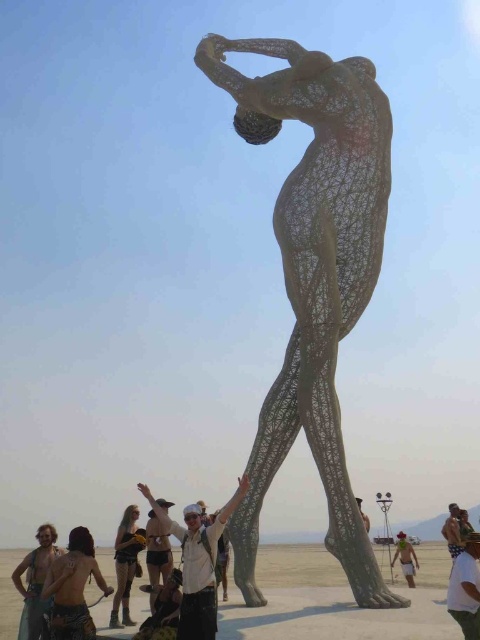
Question: Is white wire mesh figure at center behind shiny silver bikini at lower left?

Choices:
 (A) no
 (B) yes

Answer: (A)

Question: Does shiny metallic armor at lower left have a smaller size compared to matte black shorts at lower left?

Choices:
 (A) yes
 (B) no

Answer: (A)

Question: Which point is closer to the camera taking this photo?

Choices:
 (A) (337, 212)
 (B) (113, 602)
 (C) (478, 628)
 (D) (183, 573)

Answer: (C)

Question: Which object is positioned closest to the matte gray sculpture at center?

Choices:
 (A) white matte shirt at center
 (B) white wire mesh figure at center
 (C) white cotton shirt at lower center

Answer: (A)

Question: Can you confirm if shiny metallic armor at lower left is thinner than shiny silver bikini at lower left?

Choices:
 (A) yes
 (B) no

Answer: (A)

Question: Which object is the farthest from the matte black shorts at lower left?

Choices:
 (A) white wire mesh figure at center
 (B) matte gray sculpture at center
 (C) matte gray statue at center

Answer: (C)